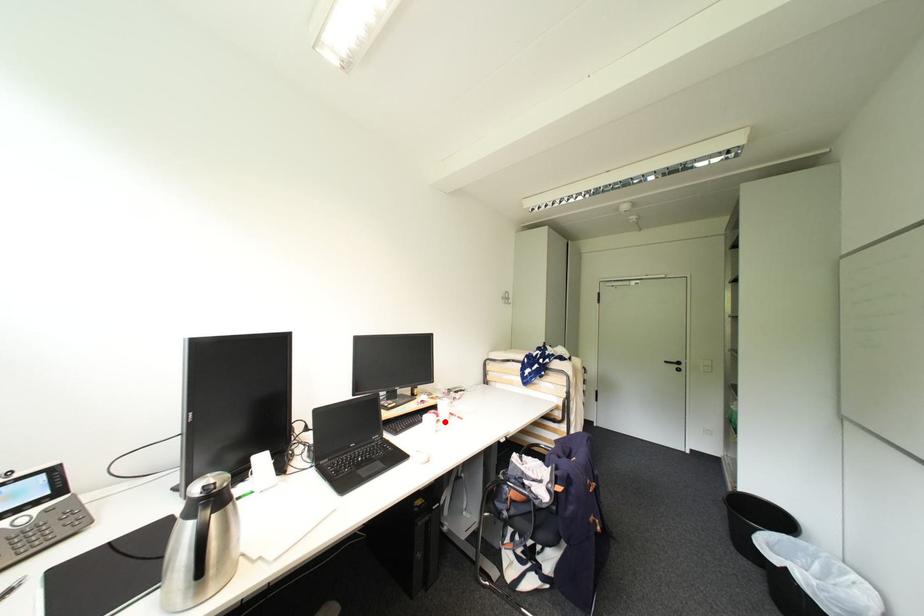
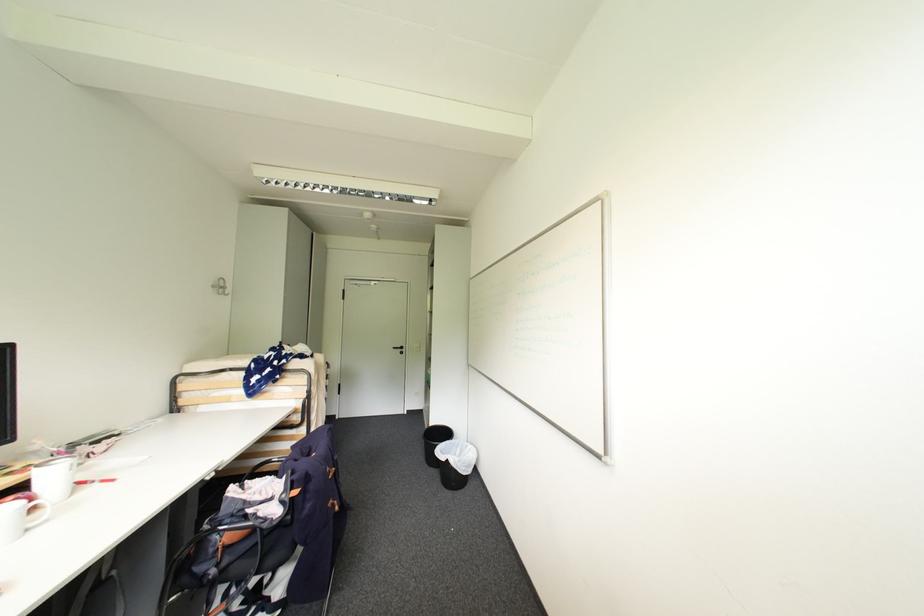
Find the pixel in the second image that matches the highlighted location in the first image.

(41, 509)